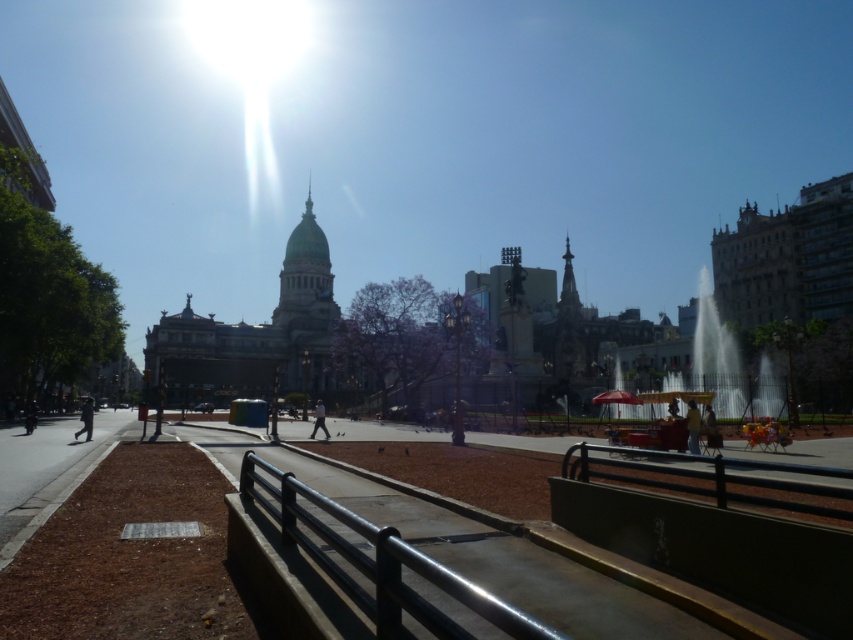
You are standing in the plaza in front of the grand neoclassical building. You see two points marked on the ground, one at point coordinates (715, 332) and the other at point coordinates (90, 406). Which point is closer to your current position?

The point at coordinates (90, 406) is closer to your current position because it is less further to the camera than point (715, 332).

You are standing on the walkway in front of the grand neoclassical building and want to move towards the yellow fabric umbrella at center. Which direction should you walk relative to the dark gray pants at lower left?

The yellow fabric umbrella at center is to the right of the dark gray pants at lower left, so you should walk towards the right relative to the dark gray pants at lower left to reach it.